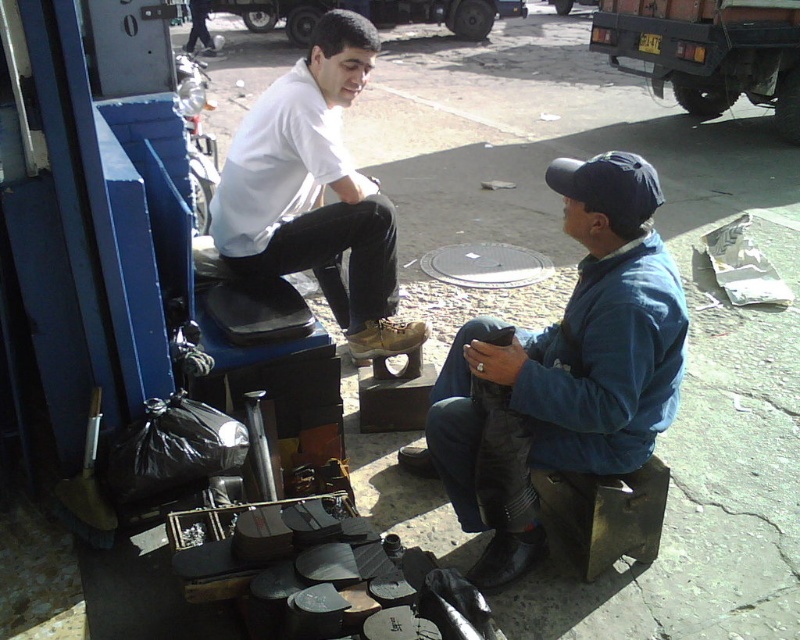
You are a photographer trying to capture both the brown leather shoe at center and the shiny black shoe at center in a single shot. Which shoe should you focus on first to ensure it appears sharp in the photo?

You should focus on the brown leather shoe at center first because it is closer to the viewer than the shiny black shoe at center, ensuring it will be in focus before adjusting for the other shoe.

You are a photographer standing at the edge of the sidewalk. You want to take a photo of the blue denim jacket at lower right and the shiny black shoe at center without any obstruction. Based on their positions, which object should you focus on first to ensure both are in frame?

The blue denim jacket at lower right is above the shiny black shoe at center, so you should focus on the shiny black shoe at center first to ensure both are in frame.

You are standing at the point marked as point (574, 417). You want to move to the nearest fire hydrant, which is located 5.91 feet away from you. Can you estimate how far you need to walk to reach it?

The point (574, 417) is 5.91 feet away from the viewer, so you need to walk 5.91 feet to reach it.